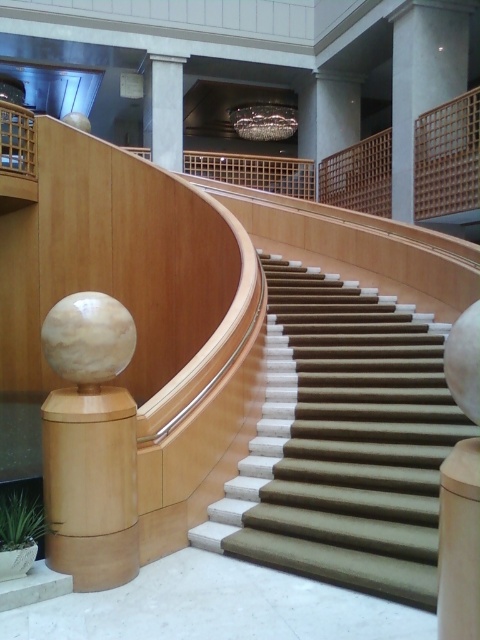
Question: Can you confirm if green carpeted stairs at center is positioned to the right of white marble column at upper center?

Choices:
 (A) yes
 (B) no

Answer: (A)

Question: Is green carpeted stairs at center bigger than white marble column at upper center?

Choices:
 (A) no
 (B) yes

Answer: (B)

Question: Estimate the real-world distances between objects in this image. Which object is closer to the wooden post at center?

Choices:
 (A) white marble column at upper center
 (B) smooth concrete pillar at upper center

Answer: (B)

Question: Which object is closer to the camera taking this photo?

Choices:
 (A) smooth concrete pillar at upper center
 (B) white marble column at upper center
 (C) green carpeted stairs at center

Answer: (C)

Question: Estimate the real-world distances between objects in this image. Which object is closer to the wooden post at center?

Choices:
 (A) white marble column at upper center
 (B) green carpeted stairs at center
 (C) smooth concrete pillar at upper center

Answer: (B)

Question: Can you confirm if green carpeted stairs at center is positioned above wooden post at center?

Choices:
 (A) no
 (B) yes

Answer: (A)